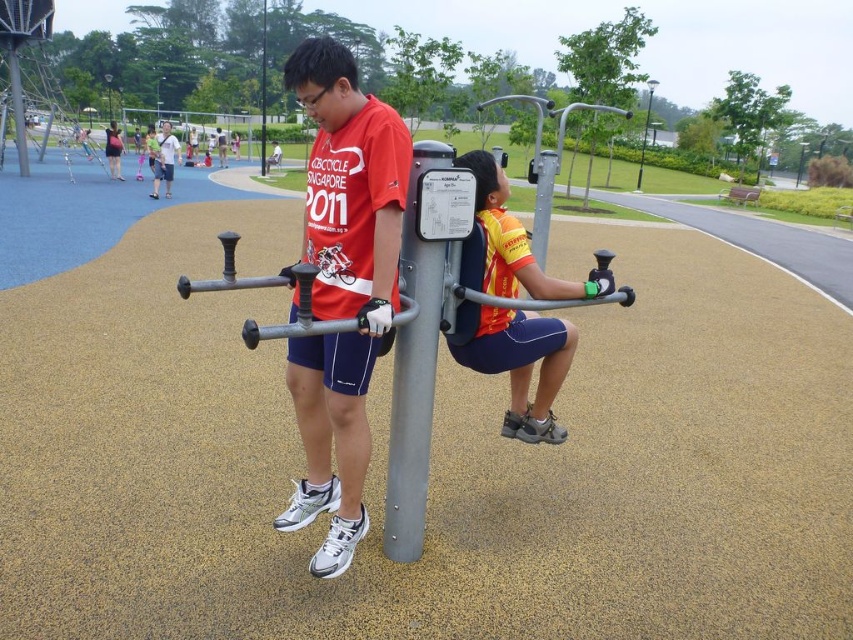
You are a photographer trying to capture both the matte red shirt at center and the brushed metal pole at center in a single shot. Considering their sizes, which object should you focus on first to ensure both are clearly visible in the frame?

The matte red shirt at center has a smaller size compared to the brushed metal pole at center. To ensure both are clearly visible, focus on the smaller matte red shirt at center first, then adjust the frame to include the larger brushed metal pole at center.

Consider the image. You are a photographer trying to capture both the matte red shirt at center and the white cotton shirt at upper left in a single frame. Based on their positions, which shirt should you focus on first to ensure both are in the frame?

The matte red shirt at center is located below the white cotton shirt at upper left, so focusing on the white cotton shirt at upper left first will help ensure both are captured in the frame.

You are a photographer trying to capture both the matte red shirt at center and the white cotton shirt at upper left in a single frame. Since you want to ensure both shirts are visible, which shirt should you focus on first to avoid blurring due to their size differences?

The matte red shirt at center has a lesser width compared to the white cotton shirt at upper left. Therefore, you should focus on the white cotton shirt at upper left first, as it is larger and might require more precise focusing to ensure clarity.